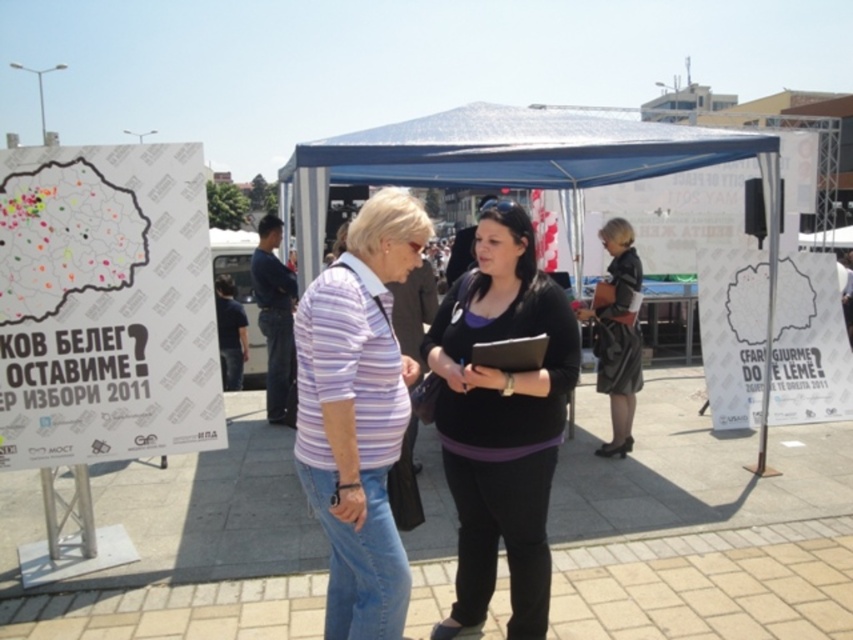
You are a photographer at the event and want to position yourself so that your camera is exactly at the coordinates given for the black matte shirt at center. What coordinates should you aim for?

You should aim for the coordinates (502, 420) to position your camera exactly at the location of the black matte shirt at center.

You are a photographer at the event and want to ensure the black matte shirt at center and the black leather skirt at center are both visible in your photo. Based on their positions, which one is more likely to be obscured by the other?

The black matte shirt at center is positioned under the black leather skirt at center, so the shirt might be partially hidden by the skirt in the photo.

You are a photographer at the event and want to capture both the purple striped shirt at center and the black leather skirt at center in a single wide shot. The camera you are using has a maximum focal length that allows capturing objects up to 3 meters apart. Will you be able to include both in the frame?

The purple striped shirt at center and black leather skirt at center are 2.96 meters apart from each other. Since the maximum distance the camera can capture is 3 meters, the 2.96 meters is within the limit. Therefore, both can be included in the frame.